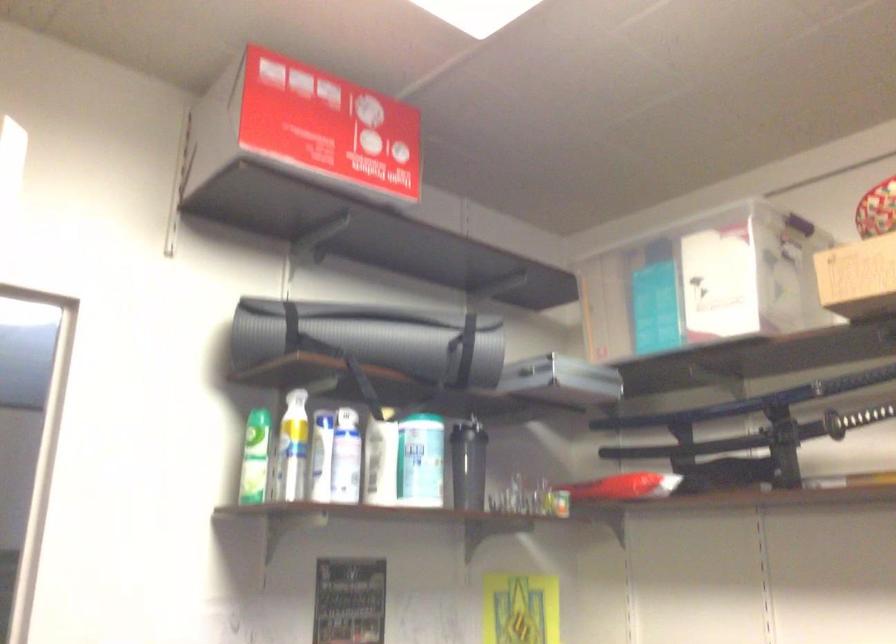
Find where to lift the rolled yoga mat. Please return your answer as a coordinate pair (x, y).

(366, 337)